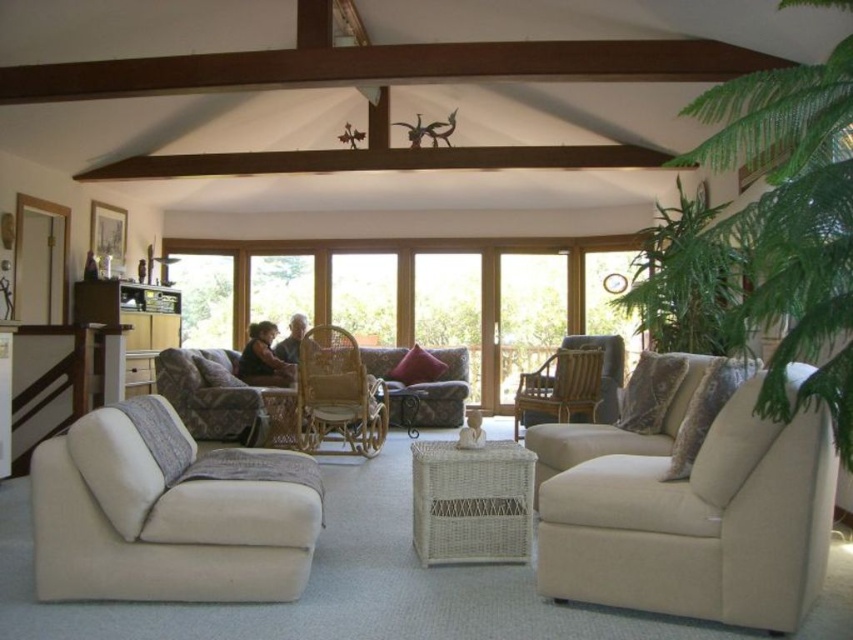
You are a delivery person carrying a package that requires you to walk 10 feet to reach the front door. You are currently standing next to the rattan armchair at center. Can you reach the front door before the package gets damaged if you walk straight towards the clear glass window at center?

The rattan armchair at center is 9.77 feet away from the clear glass window at center. Since the required distance to the front door is 10 feet, you can reach the front door before the package gets damaged by walking straight towards the clear glass window at center.